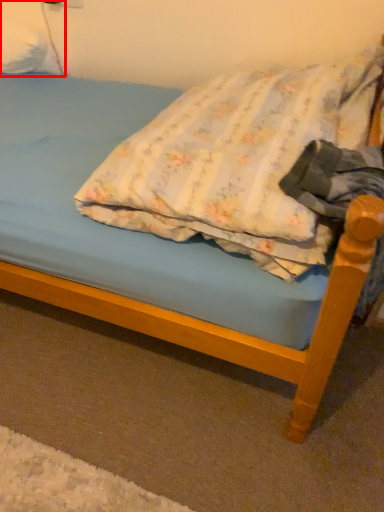
Question: From the image's perspective, considering the relative positions of pillow (annotated by the red box) and pillow in the image provided, where is pillow (annotated by the red box) located with respect to the staircase?

Choices:
 (A) above
 (B) below

Answer: (A)